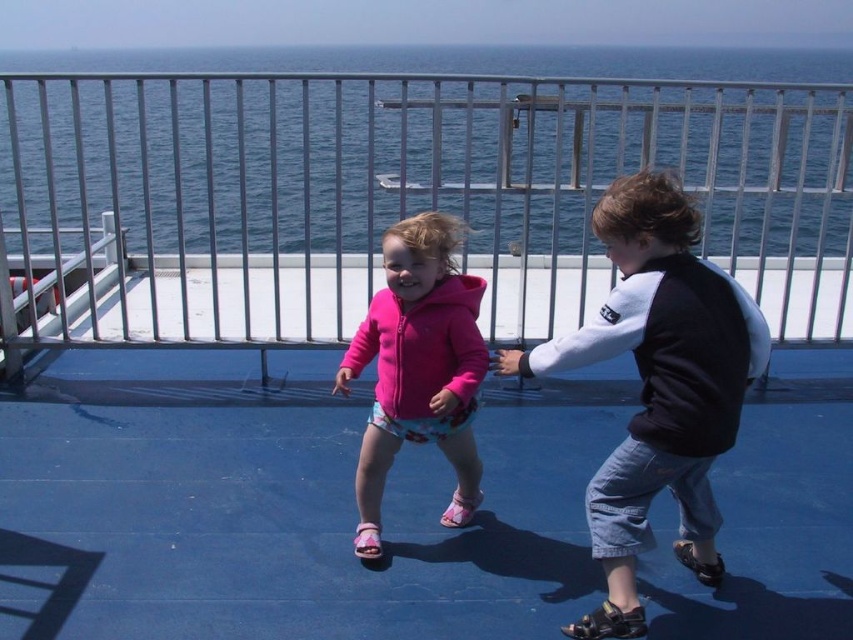
Question: Which point is closer to the camera taking this photo?

Choices:
 (A) (369, 552)
 (B) (651, 397)
 (C) (10, 220)

Answer: (B)

Question: Is black and white sweater at right to the right of pink fleece jacket at center from the viewer's perspective?

Choices:
 (A) no
 (B) yes

Answer: (B)

Question: Is the position of black and white sweater at right less distant than that of pink fleece jacket at center?

Choices:
 (A) no
 (B) yes

Answer: (B)

Question: Which of the following is the farthest from the observer?

Choices:
 (A) (453, 468)
 (B) (195, 234)

Answer: (B)

Question: Which object appears farthest from the camera in this image?

Choices:
 (A) brushed metal rail at upper center
 (B) black and white sweater at right
 (C) pink fleece jacket at center

Answer: (A)

Question: Considering the relative positions of black and white sweater at right and pink fleece jacket at center in the image provided, where is black and white sweater at right located with respect to pink fleece jacket at center?

Choices:
 (A) left
 (B) right

Answer: (B)